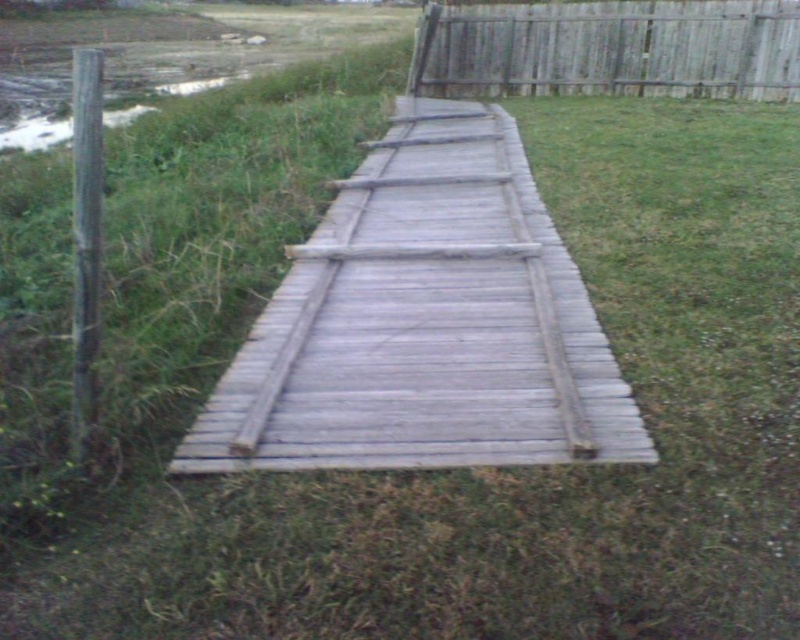
Question: Is weathered wood bridge at center in front of weathered wood fence at upper right?

Choices:
 (A) yes
 (B) no

Answer: (A)

Question: Observing the image, what is the correct spatial positioning of weathered wood bridge at center in reference to weathered wood fence at upper right?

Choices:
 (A) right
 (B) left

Answer: (B)

Question: Among these objects, which one is nearest to the camera?

Choices:
 (A) weathered wood bridge at center
 (B) weathered wood fence at upper right

Answer: (A)

Question: Does weathered wood bridge at center appear on the left side of weathered wood fence at upper right?

Choices:
 (A) no
 (B) yes

Answer: (B)

Question: Among these points, which one is nearest to the camera?

Choices:
 (A) (705, 72)
 (B) (582, 454)

Answer: (B)